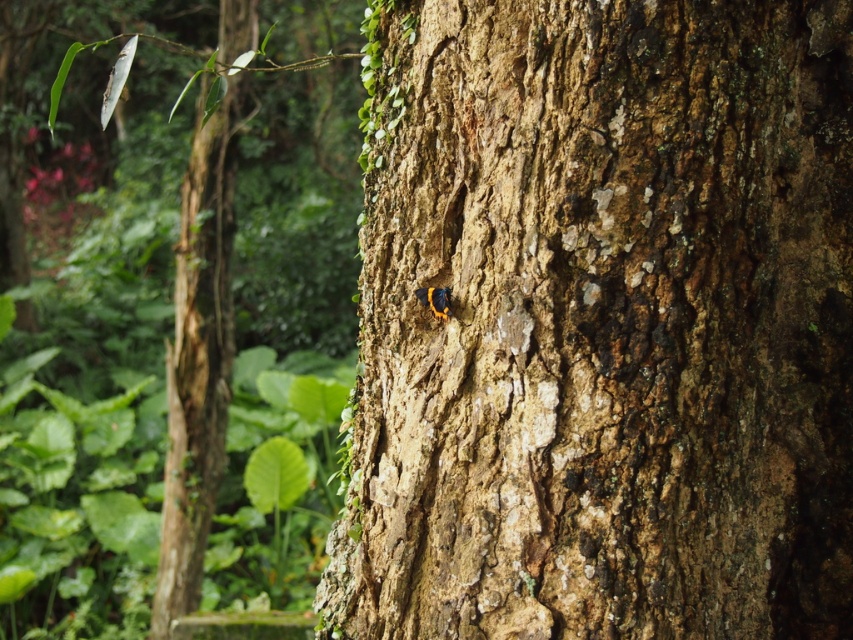
Based on the photo, is brown rough tree trunk at left thinner than shiny orange butterfly at center?

In fact, brown rough tree trunk at left might be wider than shiny orange butterfly at center.

Can you confirm if brown rough tree trunk at left is taller than shiny orange butterfly at center?

Indeed, brown rough tree trunk at left has a greater height compared to shiny orange butterfly at center.

Who is more forward, [160,580] or [433,304]?

Positioned in front is point [433,304].

I want to click on brown rough tree trunk at left, so click(x=196, y=362).

Locate an element on the screen. smooth bark tree trunk at center is located at coordinates (602, 324).

Is smooth bark tree trunk at center to the left of brown rough tree trunk at left from the viewer's perspective?

Incorrect, smooth bark tree trunk at center is not on the left side of brown rough tree trunk at left.

The height and width of the screenshot is (640, 853). What are the coordinates of `smooth bark tree trunk at center` in the screenshot? It's located at (602, 324).

Looking at this image, between rough bark tree at center and shiny orange butterfly at center, which one is positioned lower?

shiny orange butterfly at center

Measure the distance between point (277, 129) and camera.

They are 8.36 meters apart.

Locate an element on the screen. rough bark tree at center is located at coordinates (94, 353).